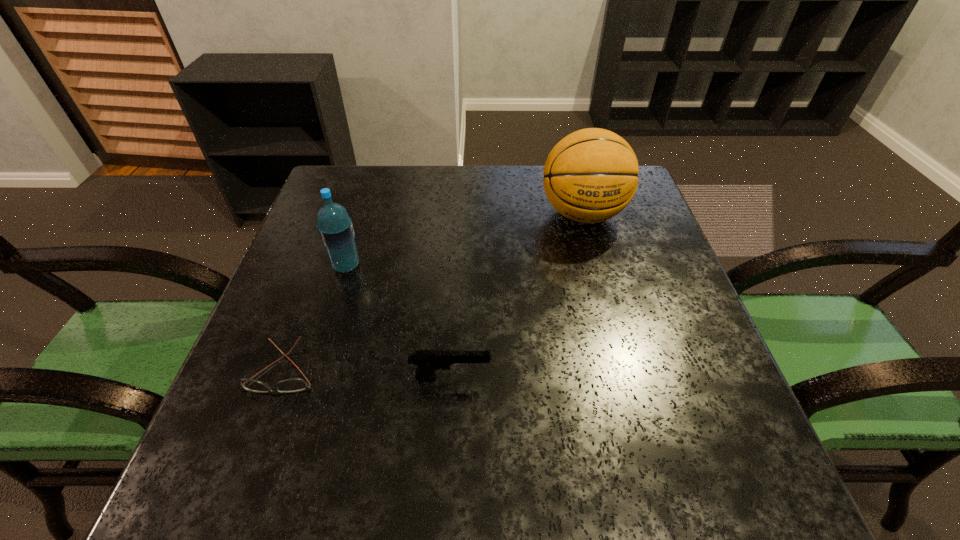
What are the coordinates of `object at the far edge` in the screenshot? It's located at (591, 175).

You are a GUI agent. You are given a task and a screenshot of the screen. Output one action in this format:
    pyautogui.click(x=<x>, y=<y>)
    Task: Click on the water bottle that is at the left edge
    
    Given the screenshot: What is the action you would take?
    pyautogui.click(x=335, y=228)

Identify the location of spectacles present at the left edge. This screenshot has height=540, width=960. (292, 385).

The image size is (960, 540). I want to click on object that is at the right edge, so click(591, 175).

The height and width of the screenshot is (540, 960). In order to click on object present at the far right corner in this screenshot , I will do `click(591, 175)`.

Identify the location of vacant space at the far edge of the desktop. This screenshot has width=960, height=540. (531, 209).

Locate an element on the screen. The width and height of the screenshot is (960, 540). vacant space at the near edge of the desktop is located at coordinates pos(490,483).

Where is `blank space at the left edge of the desktop`? Image resolution: width=960 pixels, height=540 pixels. blank space at the left edge of the desktop is located at coordinates (354, 271).

This screenshot has width=960, height=540. In the image, there is a desktop. What are the coordinates of `vacant region at the right edge` in the screenshot? It's located at (655, 273).

At what (x,y) coordinates should I click in order to perform the action: click on free location at the far left corner of the desktop. Please return your answer as a coordinate pair (x, y). The width and height of the screenshot is (960, 540). Looking at the image, I should click on (337, 183).